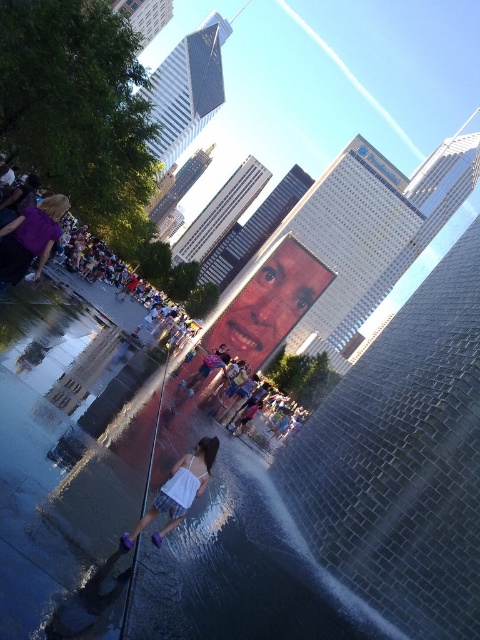
You are a photographer standing at the Crown Fountain in Chicago. You want to take a photo of the matte purple dress at left and the white fabric dress at lower center. Which dress has a narrower silhouette?

The matte purple dress at left is thinner than the white fabric dress at lower center, so the matte purple dress at left has a narrower silhouette.

Based on the photo, you are a fashion designer who wants to place a new accessory between the matte purple dress at left and the white fabric dress at lower center. Given that the accessory requires 3 meters of space to be placed comfortably, can you do so?

The distance between the matte purple dress at left and the white fabric dress at lower center is 22.05 meters. Since the accessory needs only 3 meters of space, there is sufficient room to place it comfortably between them.